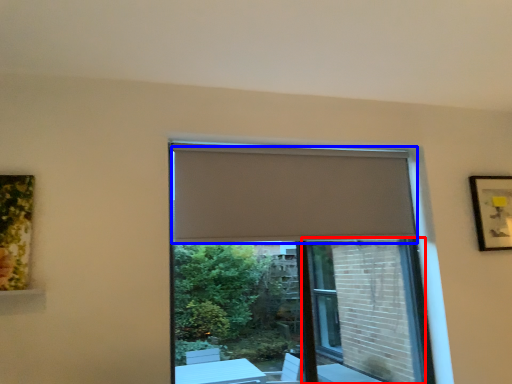
Question: Which point is further to the camera, screen door (highlighted by a red box) or curtain (highlighted by a blue box)?

Choices:
 (A) screen door
 (B) curtain

Answer: (A)